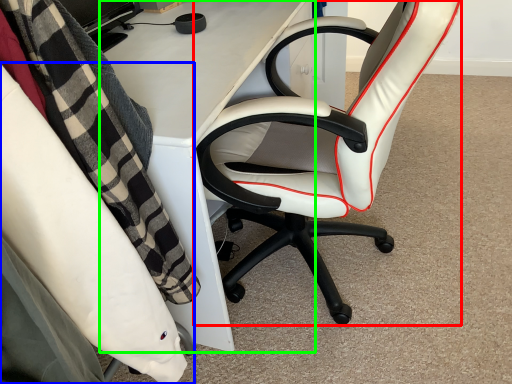
Question: Which object is the closest to the chair (highlighted by a red box)? Choose among these: chair (highlighted by a blue box) or desk (highlighted by a green box).

Choices:
 (A) chair
 (B) desk

Answer: (B)